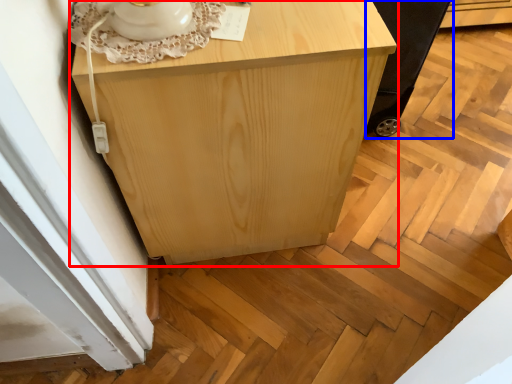
Question: Which of the following is the farthest to the observer, furniture (highlighted by a red box) or baby carriage (highlighted by a blue box)?

Choices:
 (A) furniture
 (B) baby carriage

Answer: (B)